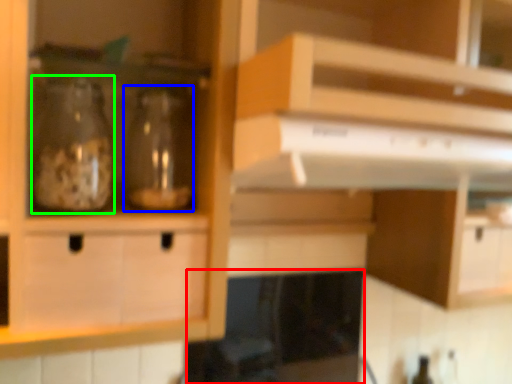
Question: Which is farther away from appliance (highlighted by a red box)? glass bottle (highlighted by a blue box) or glass bottle (highlighted by a green box)?

Choices:
 (A) glass bottle
 (B) glass bottle

Answer: (B)